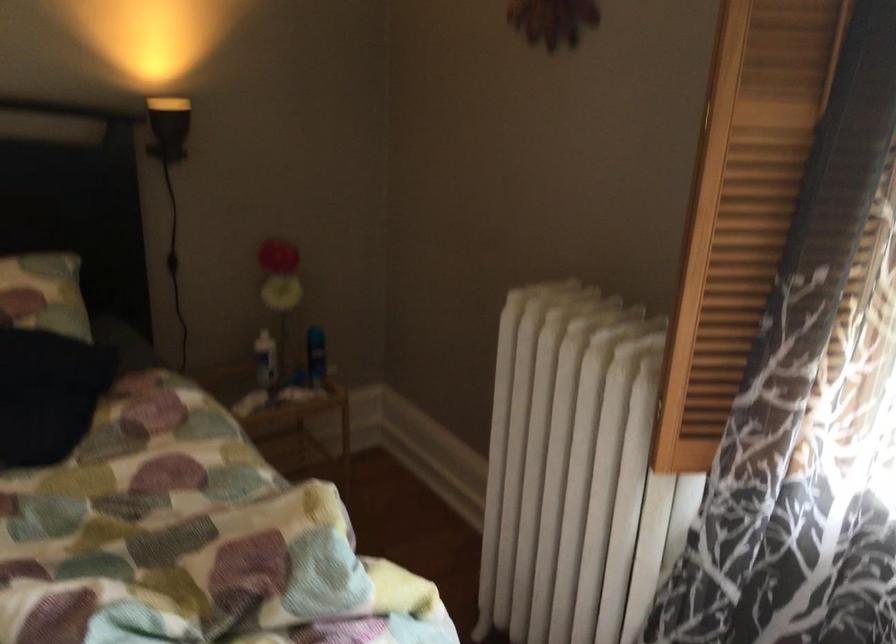
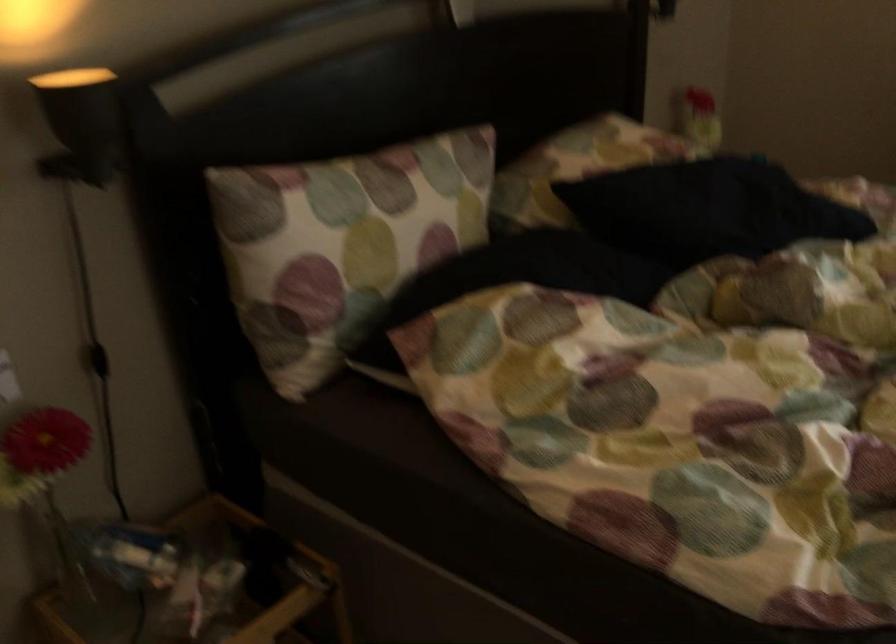
Question: Which direction would the cameraman need to move to produce the second image? Reply with the corresponding letter.

Choices:
 (A) Left
 (B) Right
 (C) Forward
 (D) Backward

Answer: (A)